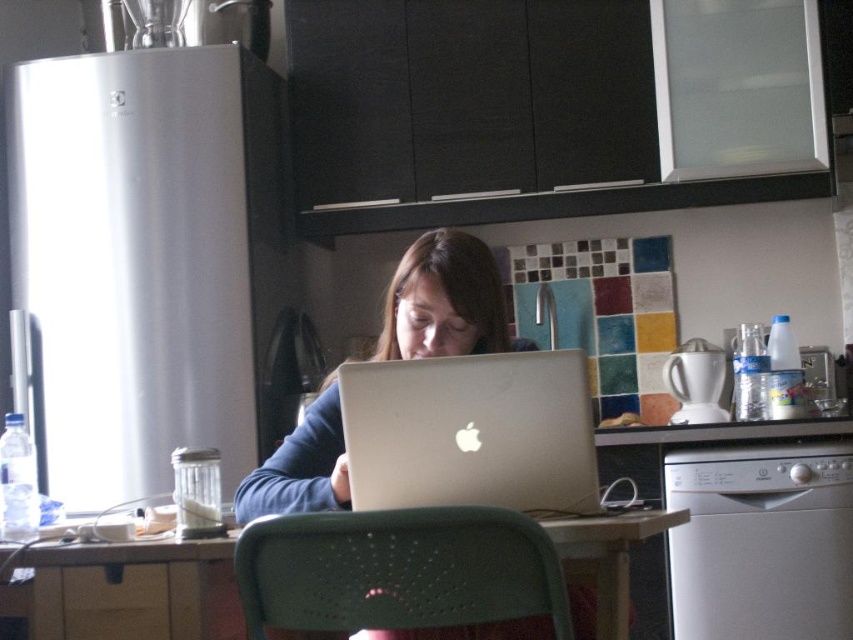
You are a person who is 1.6 meters tall and want to sit on the green perforated chair at center to use the laptop on the wooden table at center. Will your feet touch the ground?

The green perforated chair at center has a lesser height compared to wooden table at center. Since the chair is shorter, your feet will likely touch the ground comfortably.

You are a delivery robot that needs to place a small package on the wooden table at center. The package is 30 centimeters wide. Can you place it on the table without moving the matte silver laptop at center?

The distance between the wooden table at center and matte silver laptop at center is 30.42 centimeters. Since the package is 30 centimeters wide, it can be placed on the table without moving the laptop as there is enough space.

You are standing in the kitchen and want to place a small plant between the two points, point (355, 509) and point (231, 584). Which point should the plant be closer to in order to be nearer to the viewer?

The plant should be placed closer to point (355, 509) because it is closer to the viewer than point (231, 584).